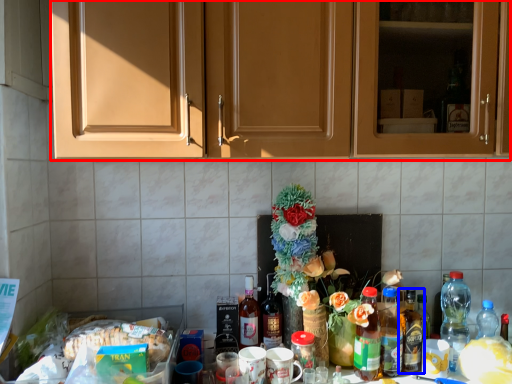
Question: Which object is closer to the camera taking this photo, cabinetry (highlighted by a red box) or bottle (highlighted by a blue box)?

Choices:
 (A) cabinetry
 (B) bottle

Answer: (A)